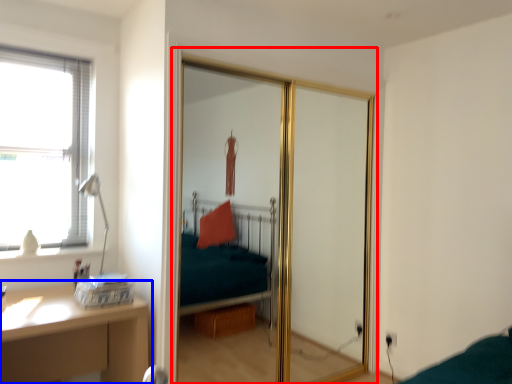
Question: Which object appears farthest to the camera in this image, screen door (highlighted by a red box) or table (highlighted by a blue box)?

Choices:
 (A) screen door
 (B) table

Answer: (A)